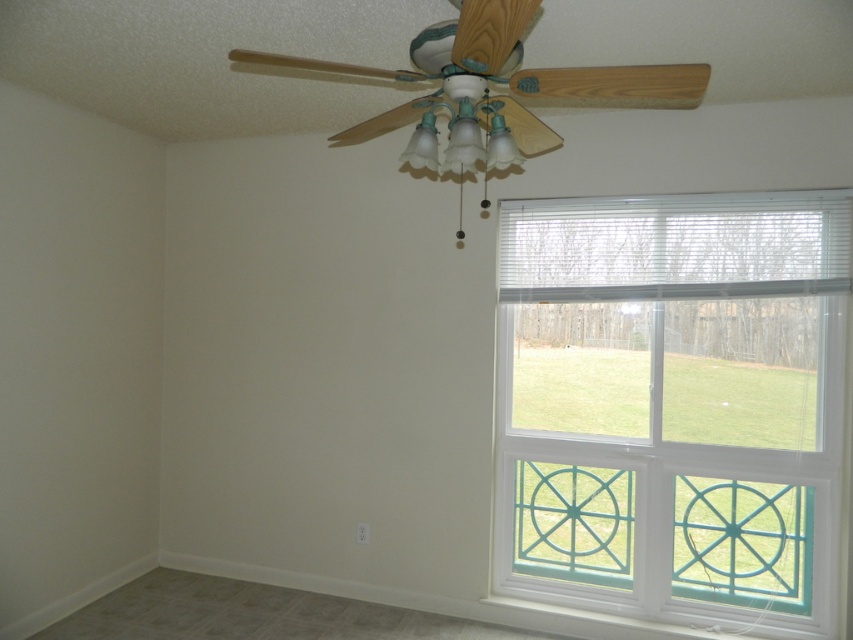
Question: Does white glass window at right have a smaller size compared to wooden ceiling fan at upper center?

Choices:
 (A) yes
 (B) no

Answer: (B)

Question: Is the position of white glass window at right more distant than that of wooden ceiling fan at upper center?

Choices:
 (A) yes
 (B) no

Answer: (A)

Question: Does white glass window at right appear over wooden ceiling fan at upper center?

Choices:
 (A) yes
 (B) no

Answer: (B)